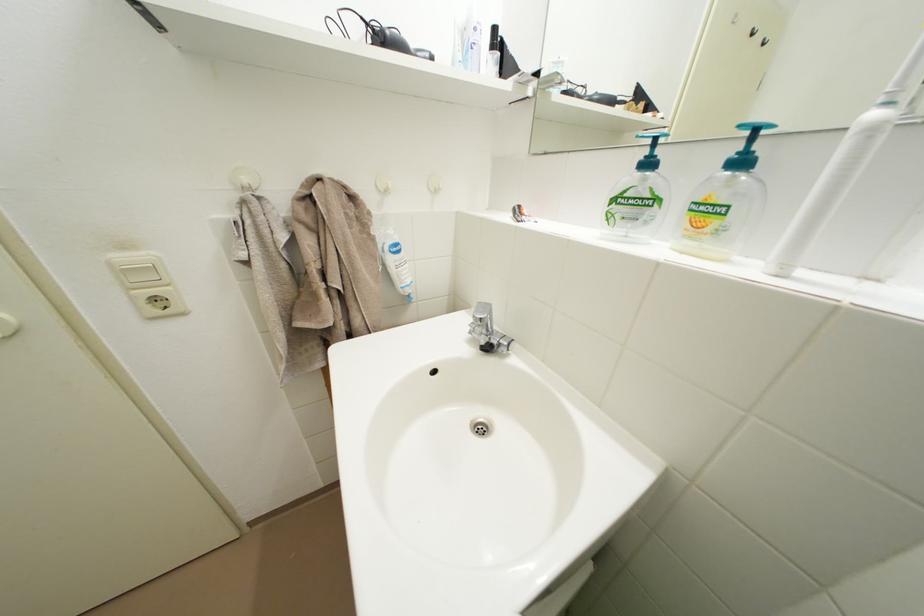
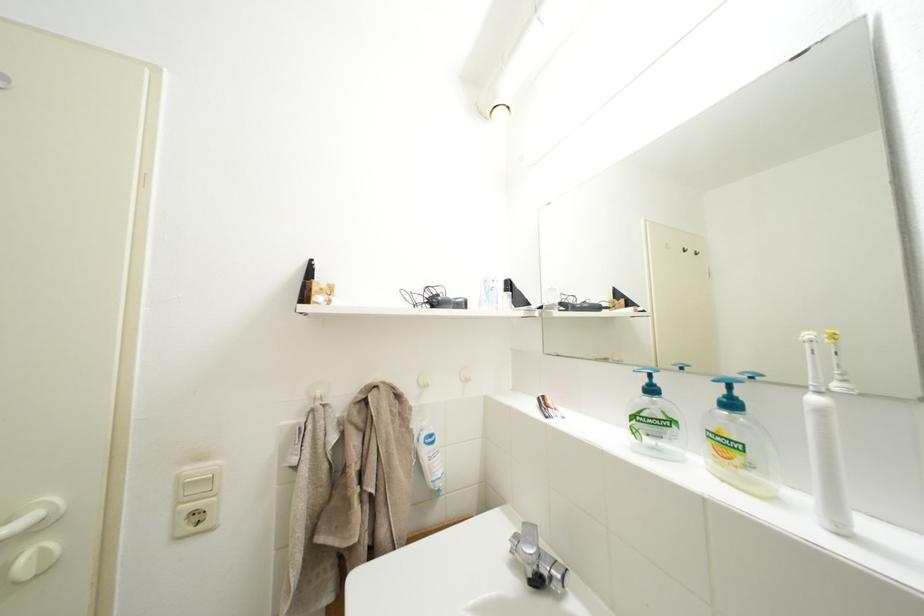
Locate, in the second image, the point that corresponds to (883,120) in the first image.

(823, 405)